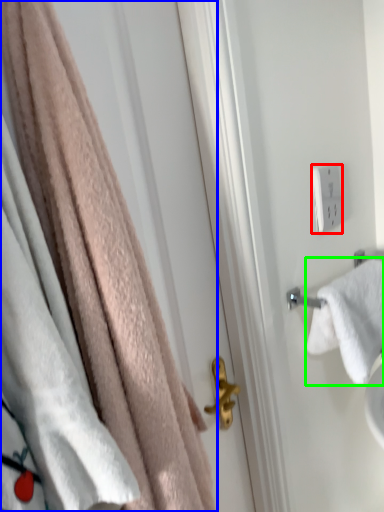
Question: Based on their relative distances, which object is farther from light switch (highlighted by a red box)? Choose from towel (highlighted by a blue box) and towel (highlighted by a green box).

Choices:
 (A) towel
 (B) towel

Answer: (A)